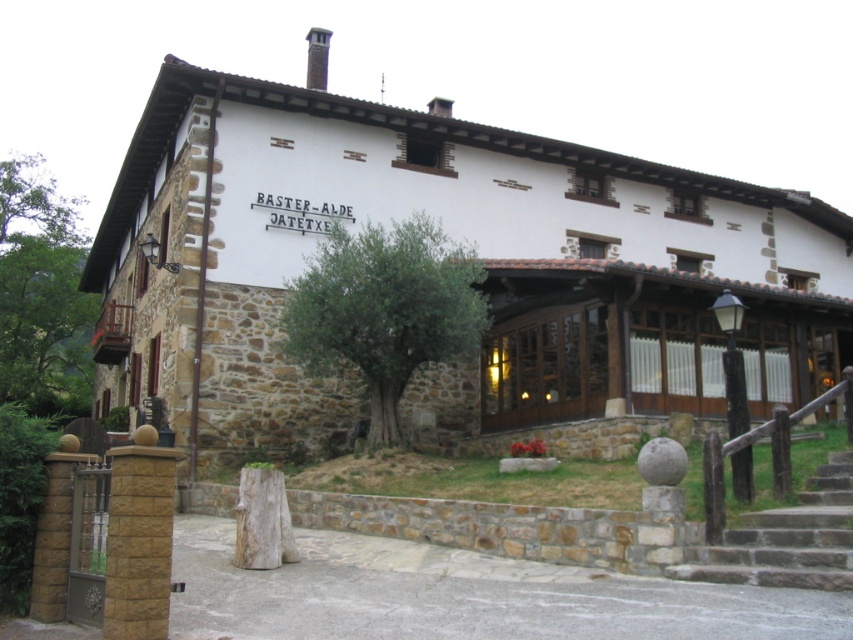
You are a visitor arriving at Baster Alde Jatetxe and want to enter the building. You see the green leafy tree at center and the brown stone stairs at lower right. Which object is directly above the other?

The green leafy tree at center is positioned over brown stone stairs at lower right, so the tree is directly above the stairs.

You are standing at the origin point in the image. Where is the white stone building at center located in terms of its 2D coordinates?

The white stone building at center is located at the 2D coordinates of point (454, 237).